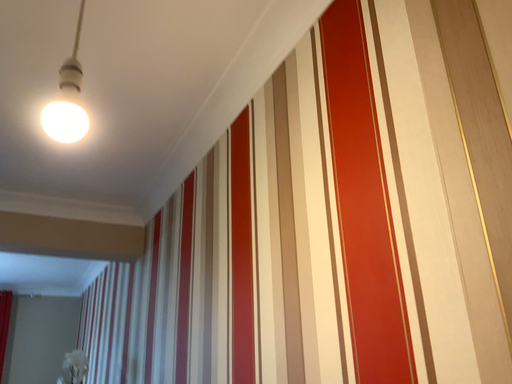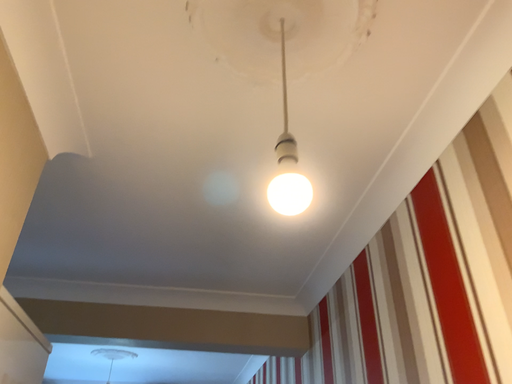
Question: Which way did the camera rotate in the video?

Choices:
 (A) rotated left
 (B) rotated right

Answer: (A)